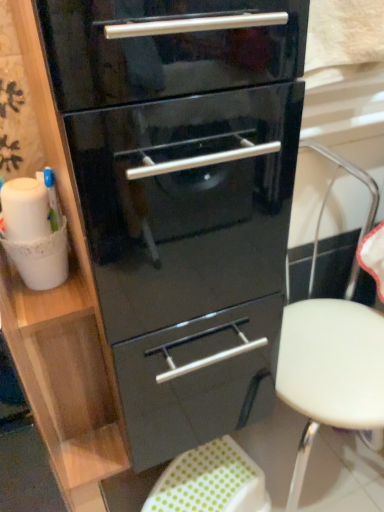
Question: From a real-world perspective, is white plastic stool at center above or below green polka dot fabric step stool at lower center?

Choices:
 (A) above
 (B) below

Answer: (A)

Question: From the image's perspective, relative to green polka dot fabric step stool at lower center, is white plastic stool at center above or below?

Choices:
 (A) below
 (B) above

Answer: (B)

Question: Which of these objects is positioned farthest from the glossy black chest of drawers at center?

Choices:
 (A) green polka dot fabric step stool at lower center
 (B) white plastic stool at center

Answer: (A)

Question: Which object is positioned farthest from the white plastic stool at center?

Choices:
 (A) glossy black chest of drawers at center
 (B) green polka dot fabric step stool at lower center

Answer: (B)